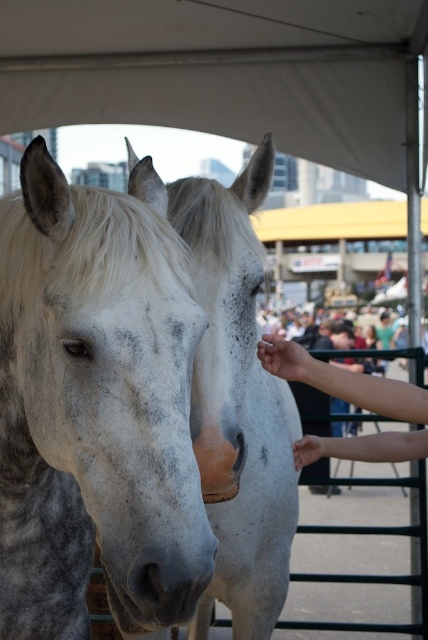
Does speckled white horse at center lie behind white speckled horse at center?

That is False.

Which is in front, point (137, 348) or point (240, 212)?

Point (137, 348) is more forward.

Find the location of a particular element. speckled white horse at center is located at coordinates (95, 406).

Does point (133, 310) come in front of point (149, 122)?

Yes, point (133, 310) is in front of point (149, 122).

Can you confirm if speckled white horse at center is bigger than white fabric canopy at upper center?

Incorrect, speckled white horse at center is not larger than white fabric canopy at upper center.

What do you see at coordinates (95, 406) in the screenshot? I see `speckled white horse at center` at bounding box center [95, 406].

Identify the location of speckled white horse at center. (95, 406).

Which is more to the left, white speckled horse at center or smooth skin hand at center?

From the viewer's perspective, white speckled horse at center appears more on the left side.

Does white speckled horse at center have a smaller size compared to smooth skin hand at center?

No, white speckled horse at center is not smaller than smooth skin hand at center.

Is point (255, 448) positioned in front of point (395, 449)?

No.

Where is `white speckled horse at center`? The height and width of the screenshot is (640, 428). white speckled horse at center is located at coordinates (237, 403).